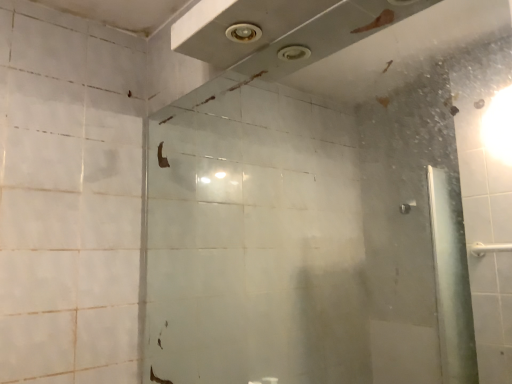
Describe the element at coordinates (243, 33) in the screenshot. The height and width of the screenshot is (384, 512). I see `matte white light fixture at upper center` at that location.

Measure the distance between matte white light fixture at upper center and camera.

1.07 meters.

Identify the location of matte white light fixture at upper center. pos(243,33).

In order to click on matte white light fixture at upper center in this screenshot , I will do `click(243, 33)`.